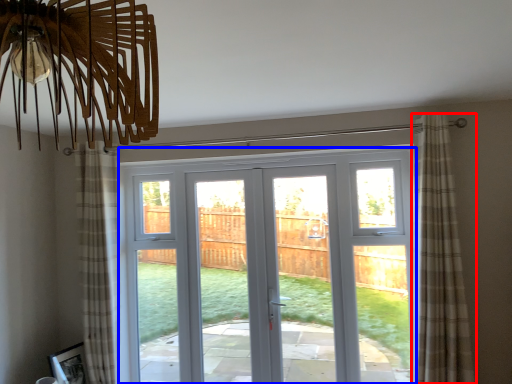
Question: Which object appears closest to the camera in this image, curtain (highlighted by a red box) or door (highlighted by a blue box)?

Choices:
 (A) curtain
 (B) door

Answer: (A)